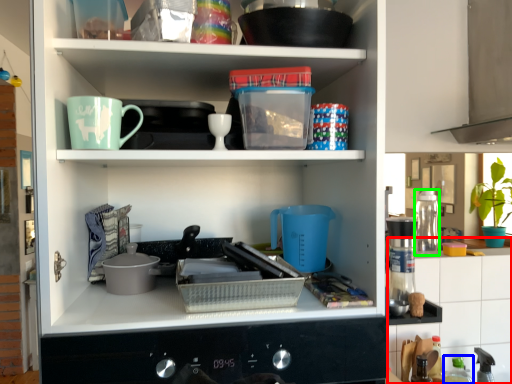
Question: Based on their relative distances, which object is farther from counter top (highlighted by a red box)? Choose from bottle (highlighted by a blue box) and appliance (highlighted by a green box).

Choices:
 (A) bottle
 (B) appliance

Answer: (B)